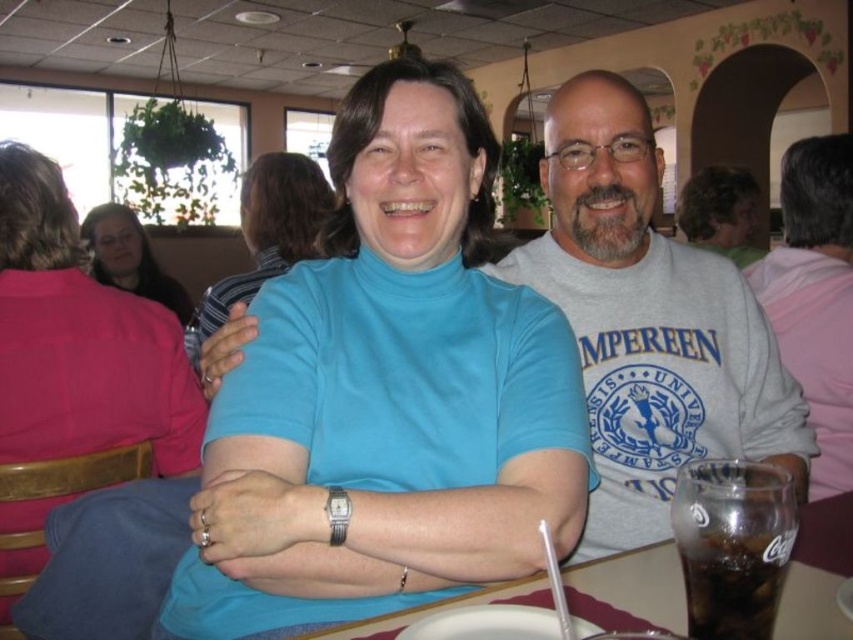
Question: In this image, where is gray cotton sweatshirt at center located relative to pink fabric shirt at upper left?

Choices:
 (A) above
 (B) below

Answer: (B)

Question: Which object is positioned closest to the gray cotton sweatshirt at center?

Choices:
 (A) pink fabric shirt at upper left
 (B) blue turtleneck sweater at center
 (C) white paper plate at lower center

Answer: (C)

Question: Which is farther from the matte blue turtleneck at center?

Choices:
 (A) white paper plate at lower center
 (B) gray cotton shirt at upper right
 (C) pink fabric shirt at upper left
 (D) clear plastic cup at lower right

Answer: (C)

Question: Which point is farther to the camera?

Choices:
 (A) (819, 515)
 (B) (766, 572)
 (C) (601, 470)

Answer: (C)

Question: Is blue turtleneck sweater at center thinner than clear plastic cup at lower right?

Choices:
 (A) no
 (B) yes

Answer: (A)

Question: In this image, where is white paper plate at lower center located relative to blue turtleneck sweater at center?

Choices:
 (A) right
 (B) left

Answer: (A)